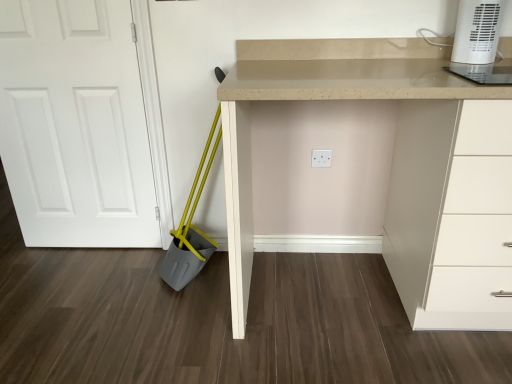
Question: Visually, is white matte door at left positioned to the left or to the right of white plastic heater at upper right?

Choices:
 (A) right
 (B) left

Answer: (B)

Question: Is point (68, 56) positioned closer to the camera than point (493, 26)?

Choices:
 (A) farther
 (B) closer

Answer: (A)

Question: Based on their relative distances, which object is farther from the white matte door at left?

Choices:
 (A) white plastic heater at upper right
 (B) beige laminate desk at center

Answer: (A)

Question: Based on their relative distances, which object is nearer to the white plastic heater at upper right?

Choices:
 (A) beige laminate desk at center
 (B) white matte door at left

Answer: (A)